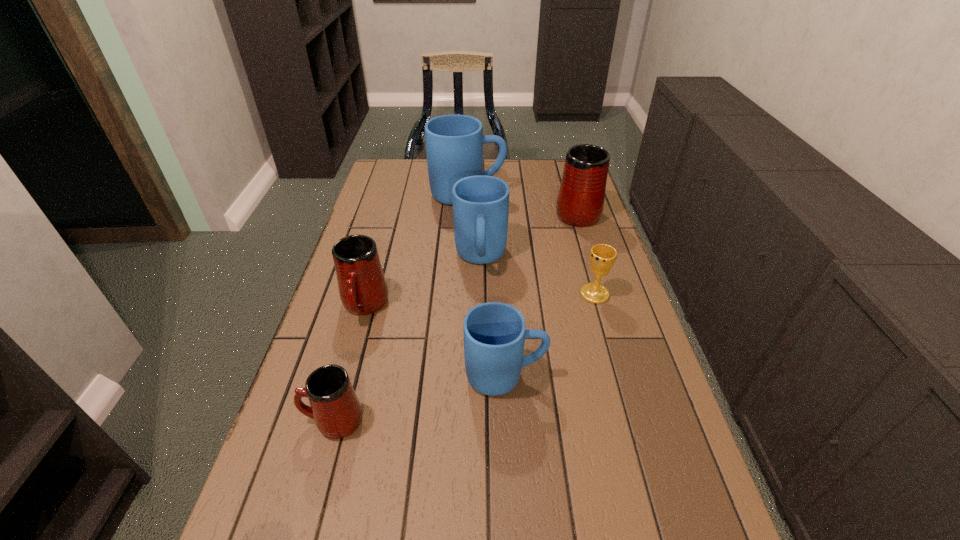
Image resolution: width=960 pixels, height=540 pixels. What are the coordinates of `the farthest blue mug` in the screenshot? It's located at (454, 143).

I want to click on the rightmost red mug, so click(580, 202).

Find the location of a particular element. the farthest red mug is located at coordinates (580, 202).

What are the coordinates of `the second farthest blue mug` in the screenshot? It's located at (480, 203).

The width and height of the screenshot is (960, 540). In order to click on the third farthest object in this screenshot , I will do `click(480, 203)`.

This screenshot has height=540, width=960. I want to click on the fourth farthest mug, so tap(363, 290).

Identify the location of the second nearest red mug. The height and width of the screenshot is (540, 960). (363, 290).

This screenshot has width=960, height=540. In order to click on the second nearest object in this screenshot , I will do `click(494, 333)`.

This screenshot has width=960, height=540. What are the coordinates of `the second nearest mug` in the screenshot? It's located at (494, 333).

You are a GUI agent. You are given a task and a screenshot of the screen. Output one action in this format:
    pyautogui.click(x=<x>, y=<y>)
    Task: Click on the chalice
    This screenshot has height=540, width=960.
    Given the screenshot: What is the action you would take?
    pyautogui.click(x=602, y=256)